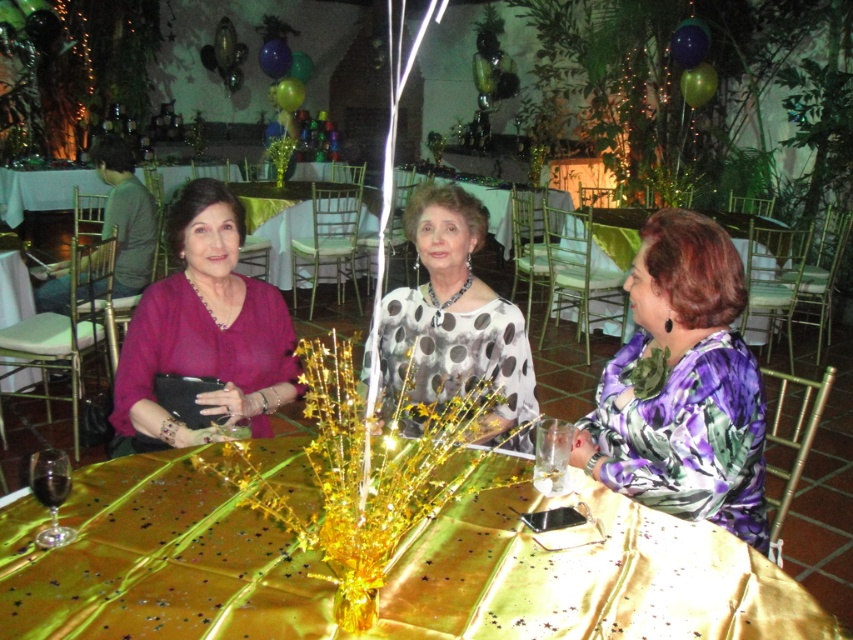
Question: Where is gold satin tablecloth at center located in relation to matte black table at center in the image?

Choices:
 (A) above
 (B) below

Answer: (A)

Question: Is matte purple blouse at left thinner than translucent glass wine glass at lower left?

Choices:
 (A) no
 (B) yes

Answer: (A)

Question: Does purple printed blouse at center lie behind gold satin table at center?

Choices:
 (A) no
 (B) yes

Answer: (A)

Question: Which of the following is the closest to the observer?

Choices:
 (A) (254, 228)
 (B) (142, 333)
 (C) (57, 476)

Answer: (C)

Question: Which point is farther to the camera?

Choices:
 (A) (277, 220)
 (B) (776, 589)

Answer: (A)

Question: Which object is positioned closest to the matte purple blouse at left?

Choices:
 (A) matte black table at center
 (B) polka dot blouse at center
 (C) gold satin table at center

Answer: (B)